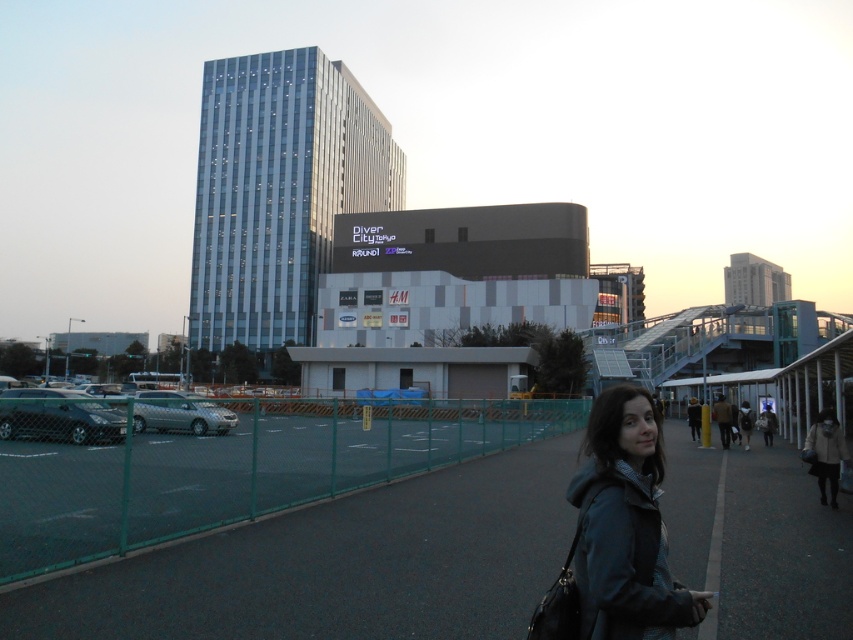
Can you confirm if glassy metallic skyscraper at center-left is smaller than dark blue jacket at center?

Actually, glassy metallic skyscraper at center-left might be larger than dark blue jacket at center.

Which is in front, point (299, 93) or point (606, 621)?

Point (606, 621) is more forward.

What do you see at coordinates (279, 192) in the screenshot? I see `glassy metallic skyscraper at center-left` at bounding box center [279, 192].

The image size is (853, 640). In order to click on glassy metallic skyscraper at center-left in this screenshot , I will do `click(279, 192)`.

Describe the element at coordinates (279, 192) in the screenshot. The image size is (853, 640). I see `glassy metallic skyscraper at center-left` at that location.

Which is below, glassy metallic skyscraper at center-left or white glass building at upper right?

Positioned lower is white glass building at upper right.

Identify the location of glassy metallic skyscraper at center-left. The width and height of the screenshot is (853, 640). (279, 192).

Does dark asphalt pavement at lower center lie behind glassy metallic skyscraper at center-left?

No, it is not.

Does point (82, 609) come in front of point (312, 248)?

Yes, it is in front of point (312, 248).

I want to click on dark asphalt pavement at lower center, so click(340, 564).